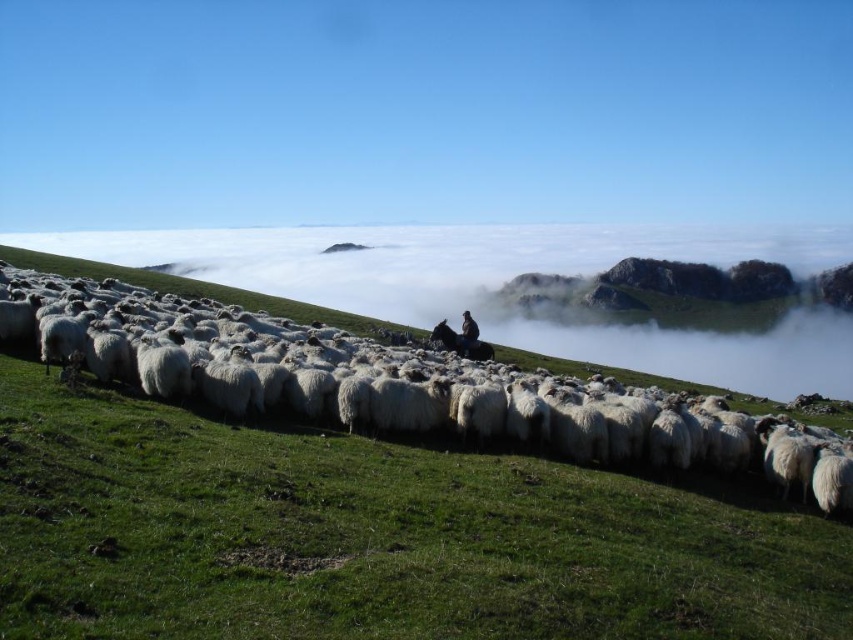
You are a photographer standing at the edge of the pasture. You want to take a photo that includes both the white fluffy wool at center and the dark brown fur at center. Which object should you focus on first to ensure both are in frame?

The white fluffy wool at center is much taller than the dark brown fur at center, so you should focus on the white fluffy wool at center first to ensure both are in frame.